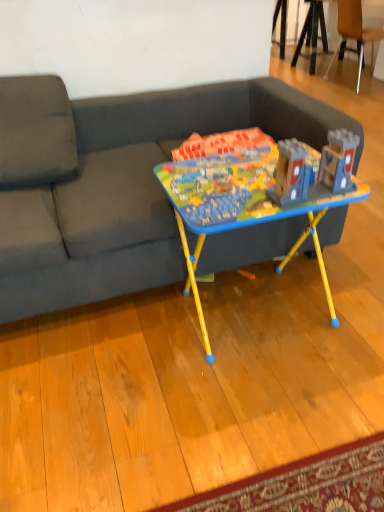
Where is `unoccupied region to the right of matte plastic table at center`? The image size is (384, 512). unoccupied region to the right of matte plastic table at center is located at coordinates (341, 300).